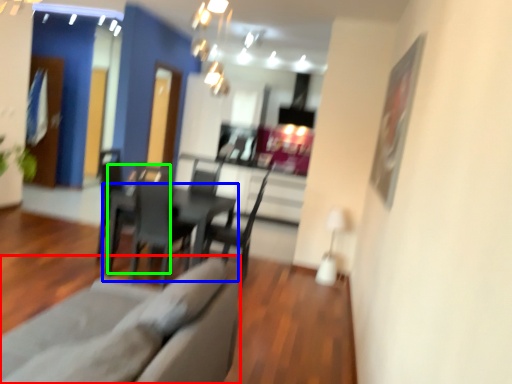
Question: Based on their relative distances, which object is nearer to couch (highlighted by a red box)? Choose from table (highlighted by a blue box) and armchair (highlighted by a green box).

Choices:
 (A) table
 (B) armchair

Answer: (B)